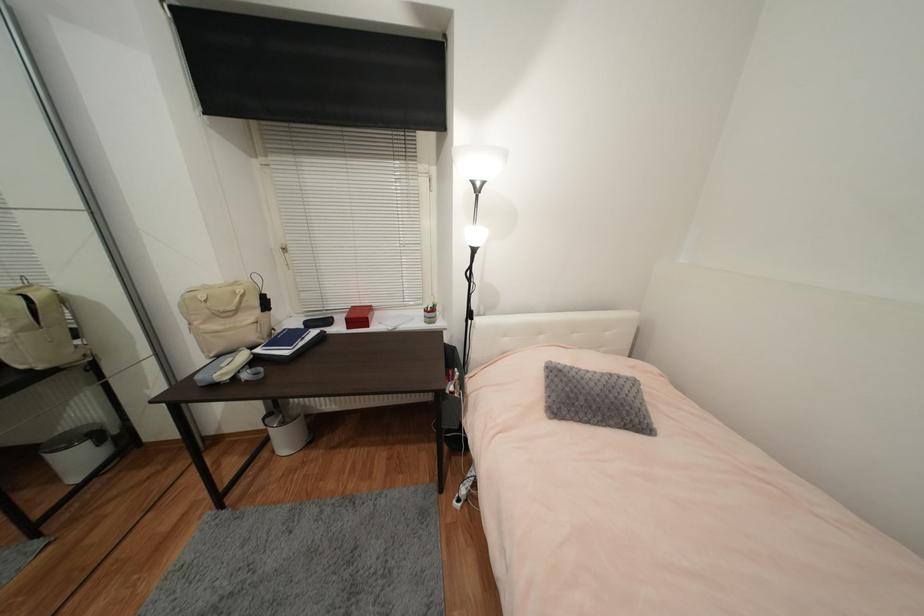
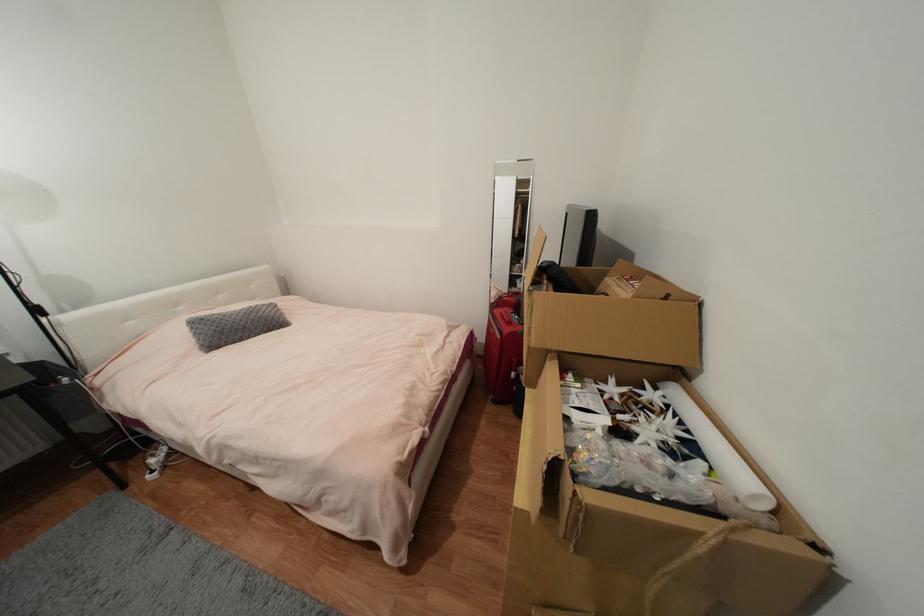
Find the pixel in the second image that matches the point at 602,391 in the first image.

(244, 320)